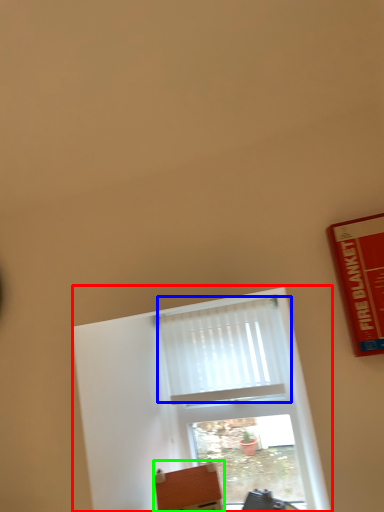
Question: Considering the real-world distances, which object is farthest from window (highlighted by a red box)? curtain (highlighted by a blue box) or furniture (highlighted by a green box)?

Choices:
 (A) curtain
 (B) furniture

Answer: (B)